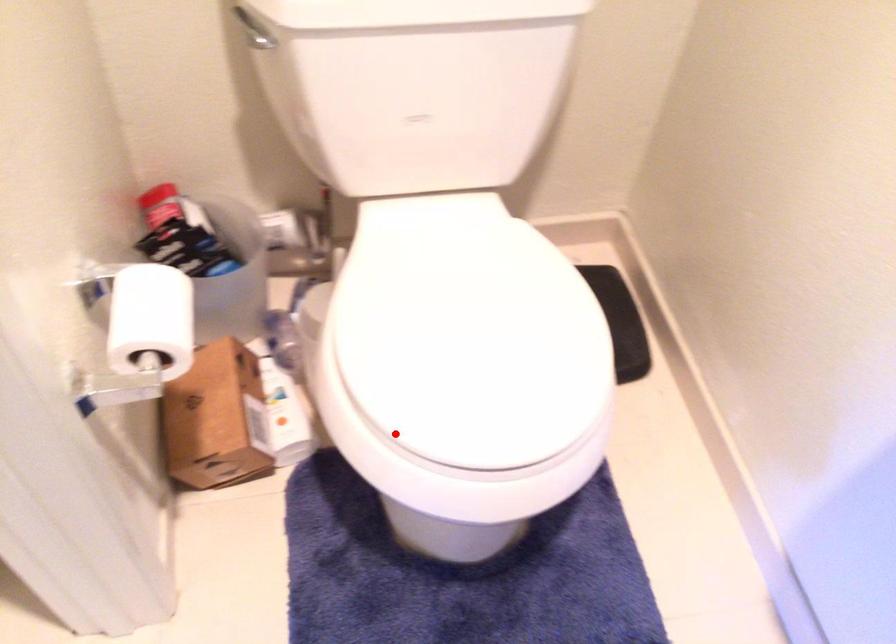
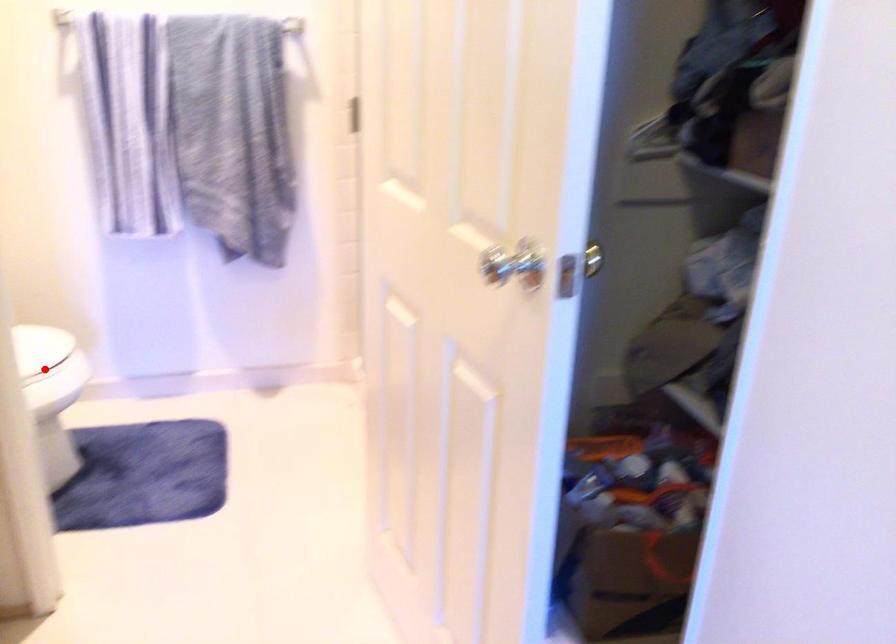
I am providing you with two images of the same scene from different viewpoints. A red point is marked on the first image and another point is marked on the second image. Is the marked point in image1 the same physical position as the marked point in image2?

Yes